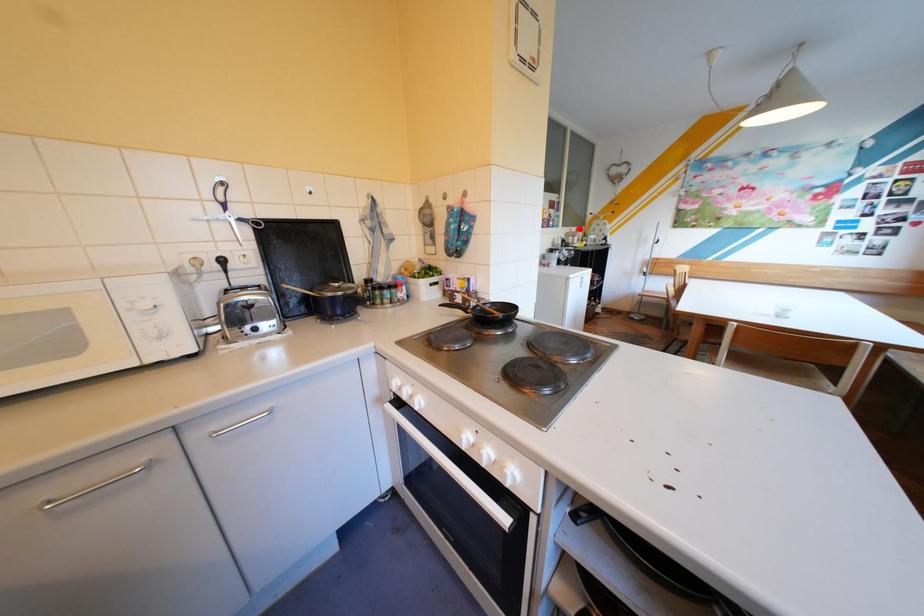
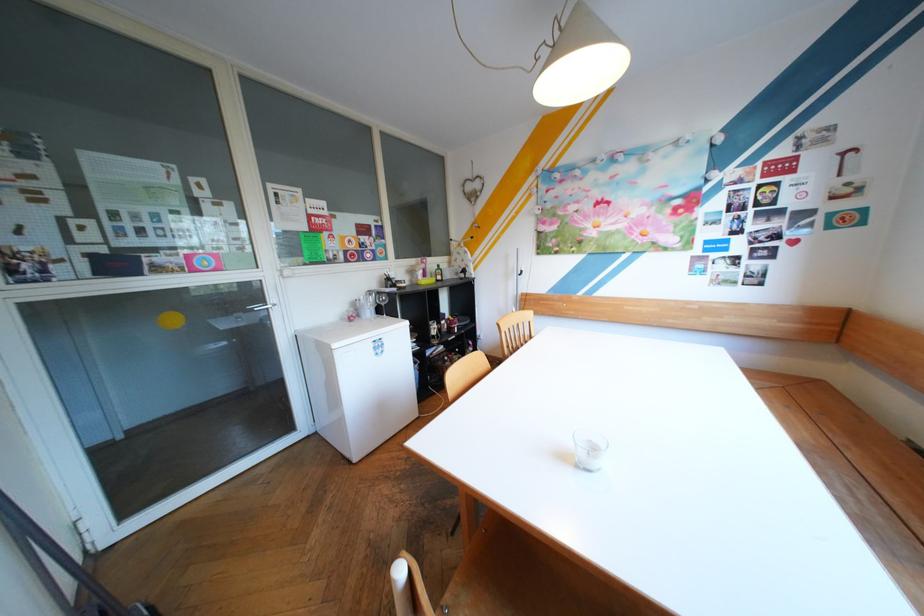
Where in the second image is the point corresponding to the highlighted location from the first image?

(426, 261)